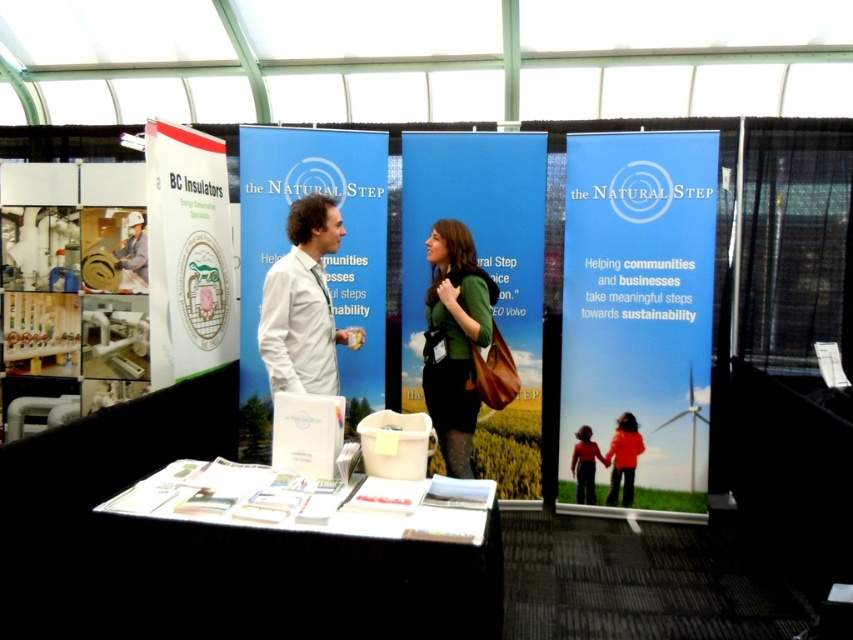
Which of these two, white shirt at center or green matte dress at center, stands shorter?

Standing shorter between the two is white shirt at center.

Can you confirm if white shirt at center is positioned to the left of green matte dress at center?

Yes, white shirt at center is to the left of green matte dress at center.

I want to click on white shirt at center, so click(x=303, y=305).

Locate an element on the screen. white shirt at center is located at coordinates (303, 305).

Does blue paperboard sign at center have a lesser width compared to white shirt at center?

No.

Can you confirm if blue paperboard sign at center is shorter than white shirt at center?

No.

Who is more distant from viewer, [584,268] or [265,353]?

The point [584,268] is more distant.

Locate an element on the screen. blue paperboard sign at center is located at coordinates (640, 296).

Is blue paperboard sign at center closer to the viewer compared to green matte dress at center?

No, blue paperboard sign at center is behind green matte dress at center.

Between point (606, 144) and point (463, 288), which one is positioned in front?

Point (463, 288)

Which is in front, point (624, 241) or point (431, 323)?

Point (431, 323) is in front.

Locate an element on the screen. Image resolution: width=853 pixels, height=640 pixels. blue paperboard sign at center is located at coordinates (640, 296).